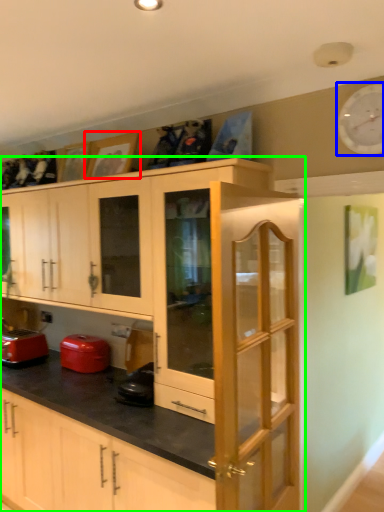
Question: Which object is positioned farthest from picture frame (highlighted by a red box)? Select from clock (highlighted by a blue box) and cabinetry (highlighted by a green box).

Choices:
 (A) clock
 (B) cabinetry

Answer: (A)